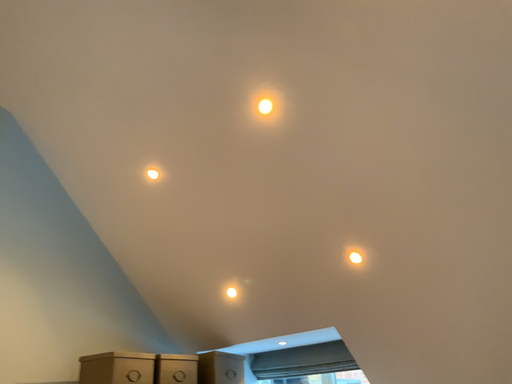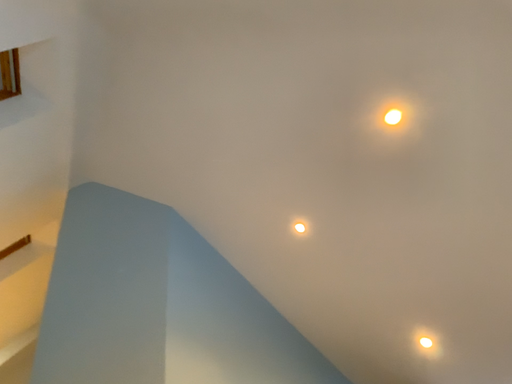
Question: Which way did the camera rotate in the video?

Choices:
 (A) rotated right
 (B) rotated left

Answer: (B)